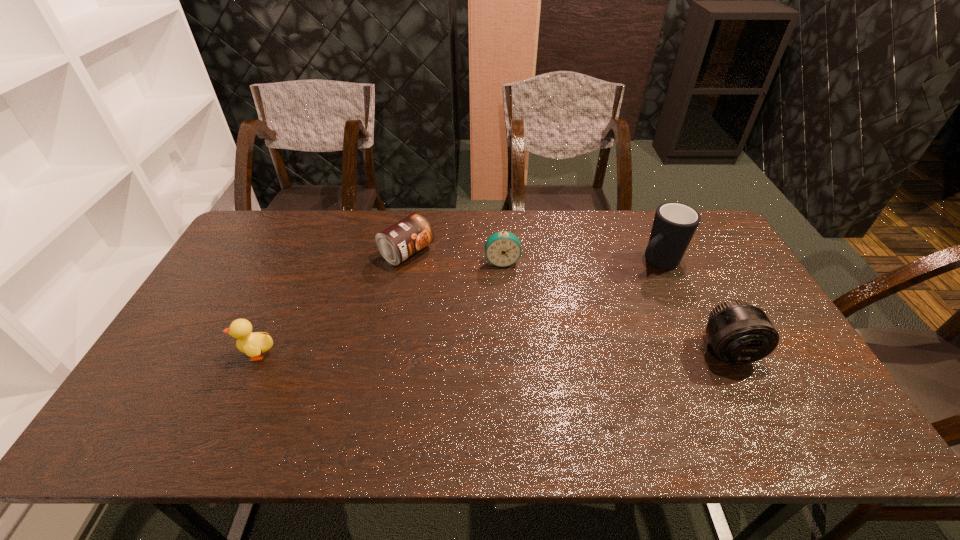
Where is `vacant space at the near edge of the desktop`? The image size is (960, 540). vacant space at the near edge of the desktop is located at coordinates (x=492, y=383).

The width and height of the screenshot is (960, 540). In the image, there is a desktop. What are the coordinates of `vacant space at the left edge` in the screenshot? It's located at (231, 282).

What are the coordinates of `free space at the right edge of the desktop` in the screenshot? It's located at (737, 264).

Locate an element on the screen. This screenshot has height=540, width=960. vacant region at the far left corner is located at coordinates (291, 212).

You are a GUI agent. You are given a task and a screenshot of the screen. Output one action in this format:
    pyautogui.click(x=<x>, y=<y>)
    Task: Click on the free space at the near left corner
    This screenshot has width=960, height=540.
    Given the screenshot: What is the action you would take?
    pyautogui.click(x=158, y=395)

This screenshot has width=960, height=540. I want to click on empty location between the alarm clock and the can, so click(454, 257).

I want to click on vacant space that is in between the mug and the can, so click(532, 257).

The image size is (960, 540). I want to click on blank region between the mug and the third object from left to right, so click(580, 262).

At what (x,y) coordinates should I click in order to perform the action: click on free area in between the third object from left to right and the telephoto lens. Please return your answer as a coordinate pair (x, y). Image resolution: width=960 pixels, height=540 pixels. Looking at the image, I should click on (615, 306).

This screenshot has height=540, width=960. In order to click on free spot between the tallest object and the leftmost object in this screenshot , I will do `click(457, 308)`.